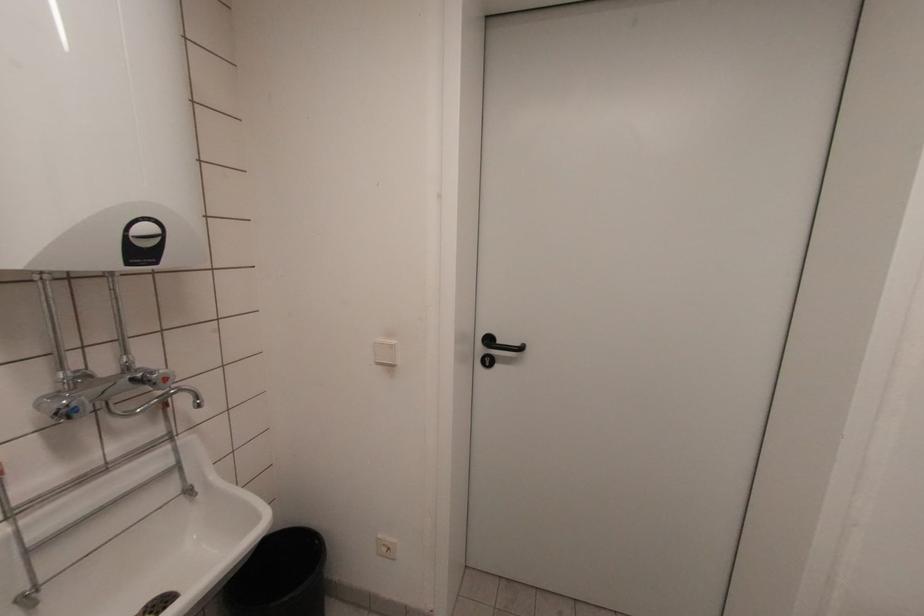
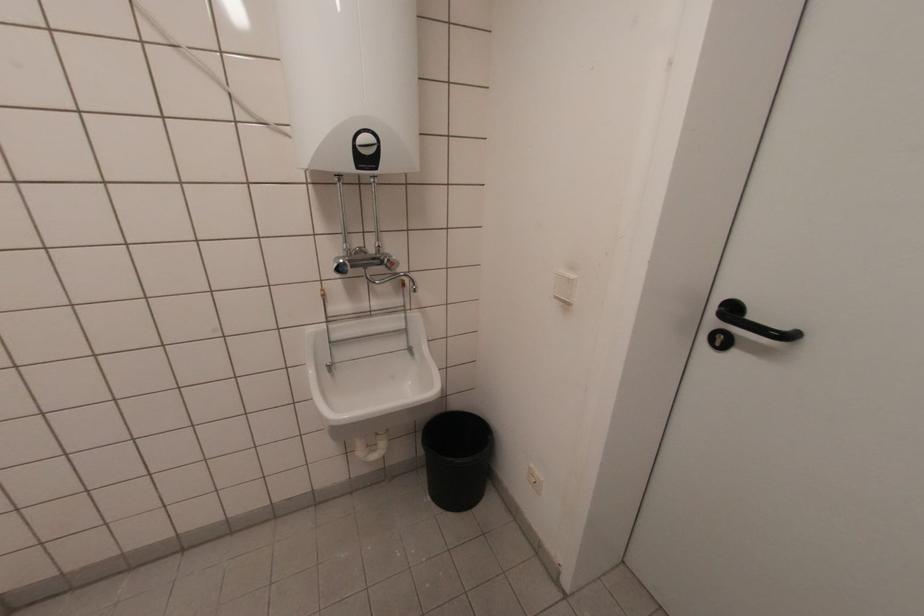
Locate, in the second image, the point that corresponds to (317,543) in the first image.

(490, 438)